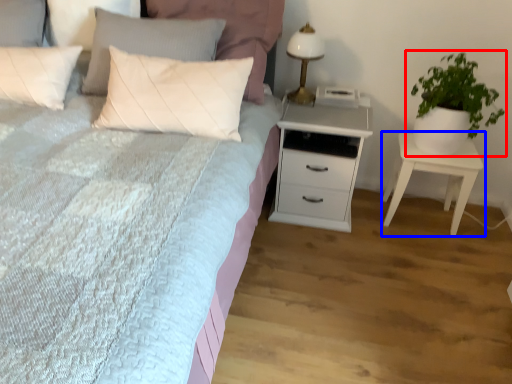
Question: Which of the following is the closest to the observer, houseplant (highlighted by a red box) or nightstand (highlighted by a blue box)?

Choices:
 (A) houseplant
 (B) nightstand

Answer: (A)